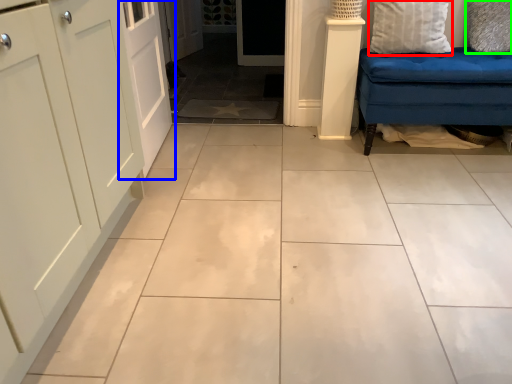
Question: Estimate the real-world distances between objects in this image. Which object is farther from pillow (highlighted by a red box), door (highlighted by a blue box) or pillow (highlighted by a green box)?

Choices:
 (A) door
 (B) pillow

Answer: (A)